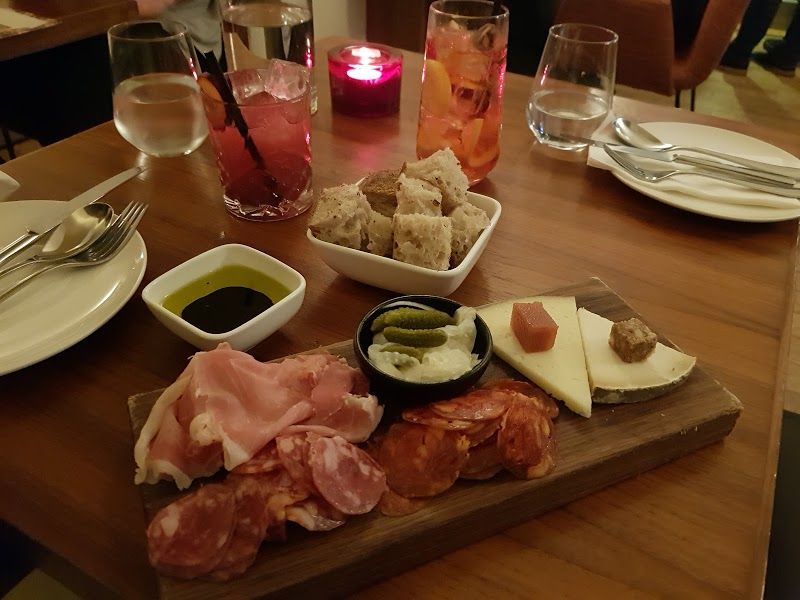
This screenshot has width=800, height=600. What are the coordinates of `charcuterie board` in the screenshot? It's located at (598, 443).